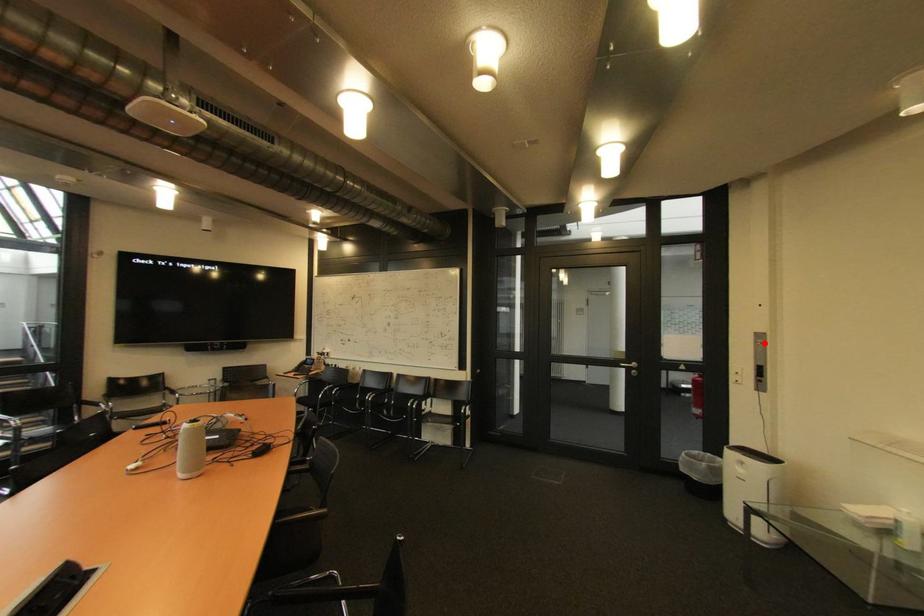
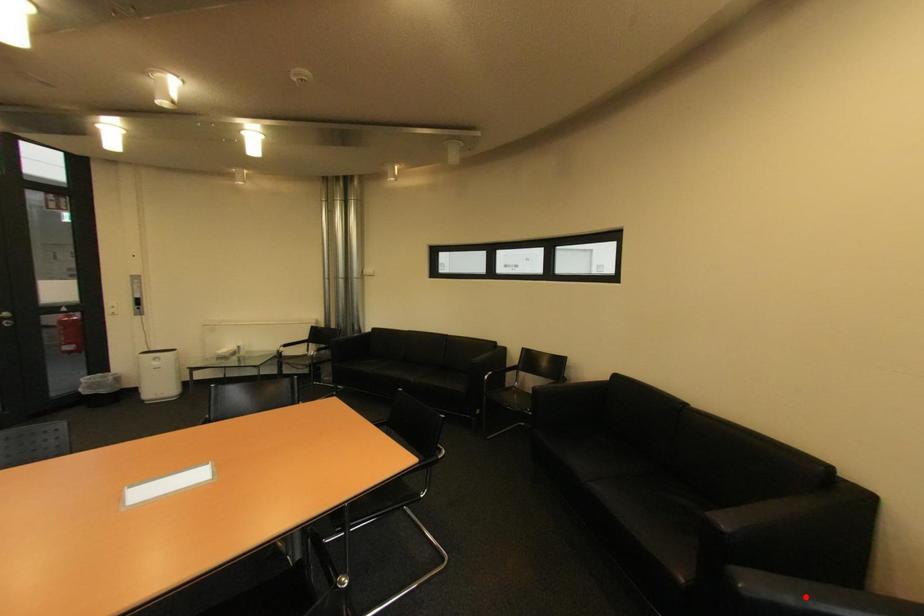
I am providing you with two images of the same scene from different viewpoints. A red point is marked on the first image and another point is marked on the second image. Are the points marked in image1 and image2 representing the same 3D position?

No